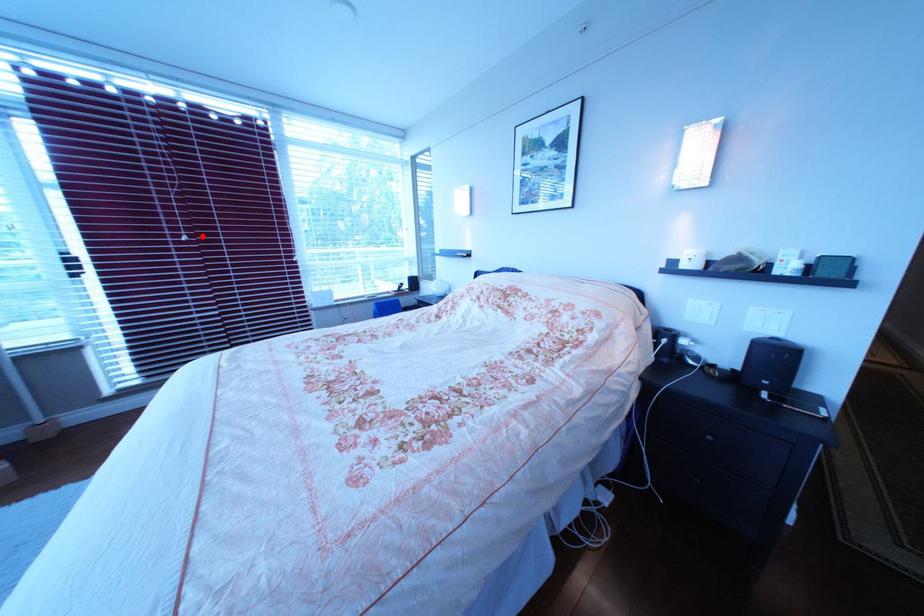
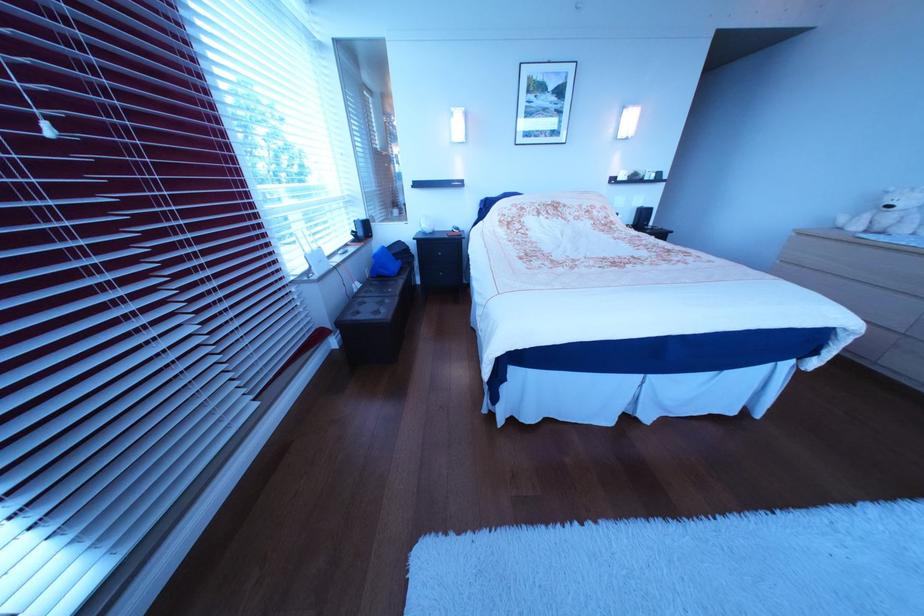
Question: A red point is marked in image1. In image2, is the corresponding 3D point closer to the camera or farther? Reply with the corresponding letter.

Choices:
 (A) The corresponding 3D point is closer.
 (B) The corresponding 3D point is farther.

Answer: (B)